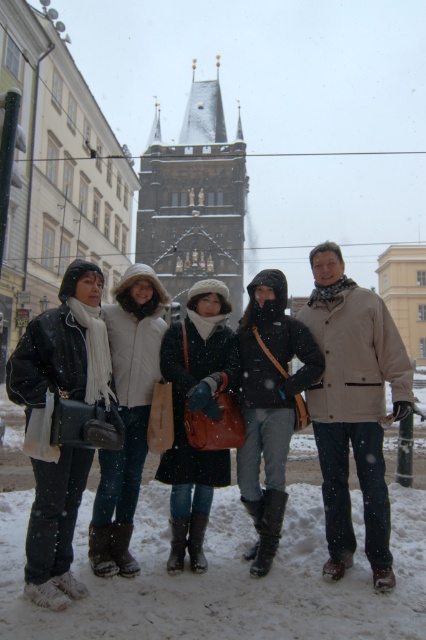
You are a photographer standing at the edge of the snowy square, wanting to capture both the brown stone tower at center and the white woolen hat at center in the same frame. Given that your camera has a maximum focal length that allows a 100 meter distance between the closest and farthest objects in focus, will you be able to include both in a single sharp photo?

The brown stone tower at center and white woolen hat at center are 94.33 meters apart from each other. Since the distance between them is less than the camera maximum focal length of 100 meters, you can include both in a single sharp photo.

You are standing in the snowy scene near the historic building. You see two points marked in the image. Which point is closer to you, point (81,275) or point (183,381)?

Point (81,275) is in front of point (183,381), so it is closer to you.

You are a photographer standing in a snowy urban area and want to capture a photo of the group of six individuals and the brown stone tower at center. Given that the tower is 128.44 meters away from you, can you estimate whether the group and the tower will be in the same frame?

The brown stone tower at center is 128.44 meters away from the camera. Since the group is positioned closely together near the photographer, they will likely be in the foreground while the tower is in the background. This arrangement should allow both the group and the tower to be captured in the same frame, provided the camera has an appropriate focal length and angle of view to encompass both subjects at those distances.